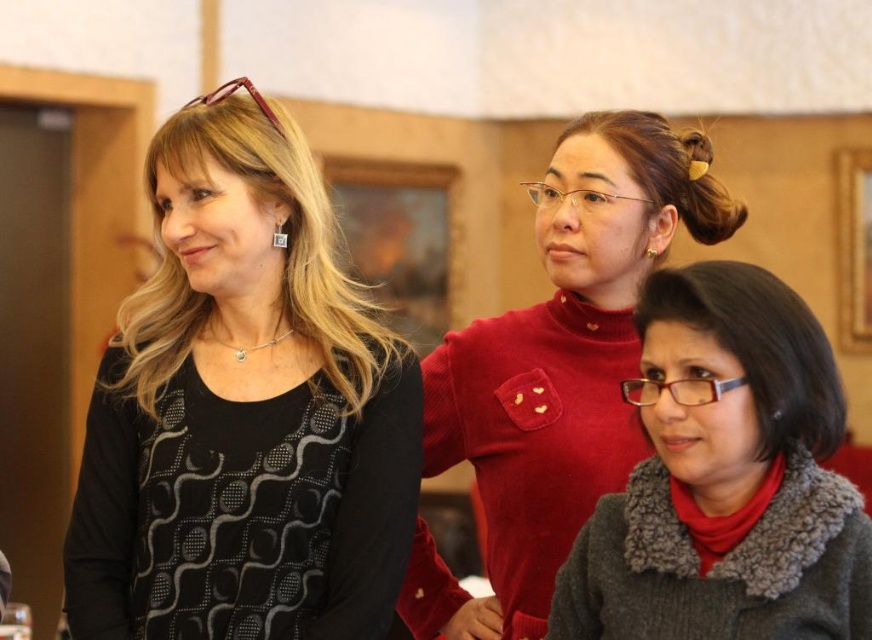
Which is more to the right, black dotted sweater at left or gray fuzzy sweater at center?

From the viewer's perspective, gray fuzzy sweater at center appears more on the right side.

Who is taller, black dotted sweater at left or gray fuzzy sweater at center?

Standing taller between the two is black dotted sweater at left.

Looking at this image, measure the distance between black dotted sweater at left and camera.

They are 1.59 meters apart.

Identify the location of black dotted sweater at left. The height and width of the screenshot is (640, 872). (243, 412).

Does point (719, 557) come closer to viewer compared to point (576, 291)?

Yes, point (719, 557) is in front of point (576, 291).

Does gray fuzzy sweater at center appear under matte red sweater at center?

Yes.

Locate an element on the screen. This screenshot has width=872, height=640. gray fuzzy sweater at center is located at coordinates (726, 477).

Is the position of black dotted sweater at left less distant than that of matte red sweater at center?

No, black dotted sweater at left is further to the viewer.

Can you confirm if black dotted sweater at left is smaller than matte red sweater at center?

Indeed, black dotted sweater at left has a smaller size compared to matte red sweater at center.

Where is `black dotted sweater at left`? The height and width of the screenshot is (640, 872). black dotted sweater at left is located at coordinates (243, 412).

You are a GUI agent. You are given a task and a screenshot of the screen. Output one action in this format:
    pyautogui.click(x=<x>, y=<y>)
    Task: Click on the black dotted sweater at left
    Image resolution: width=872 pixels, height=640 pixels.
    Given the screenshot: What is the action you would take?
    pyautogui.click(x=243, y=412)